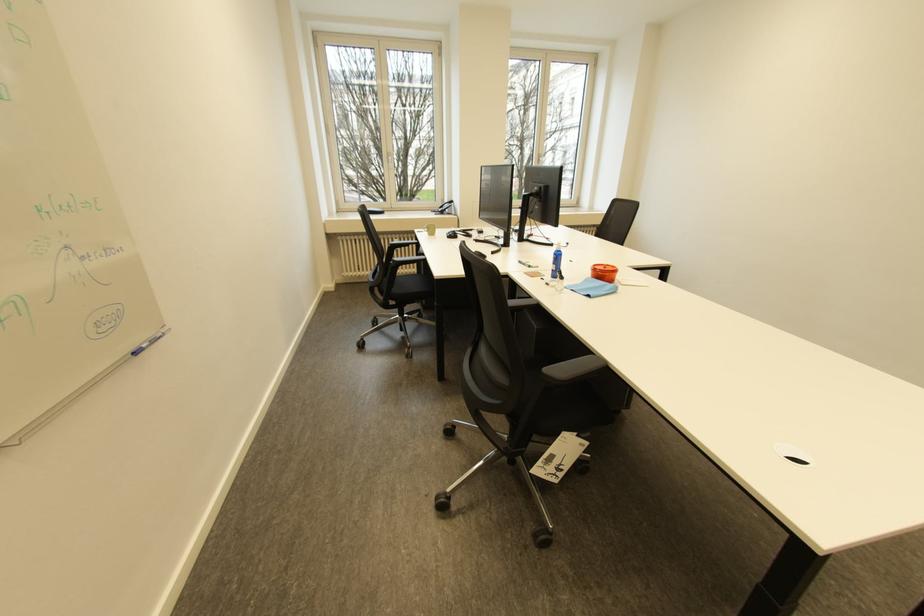
Which object does [555,265] point to?

It corresponds to the blue spray bottle in the image.